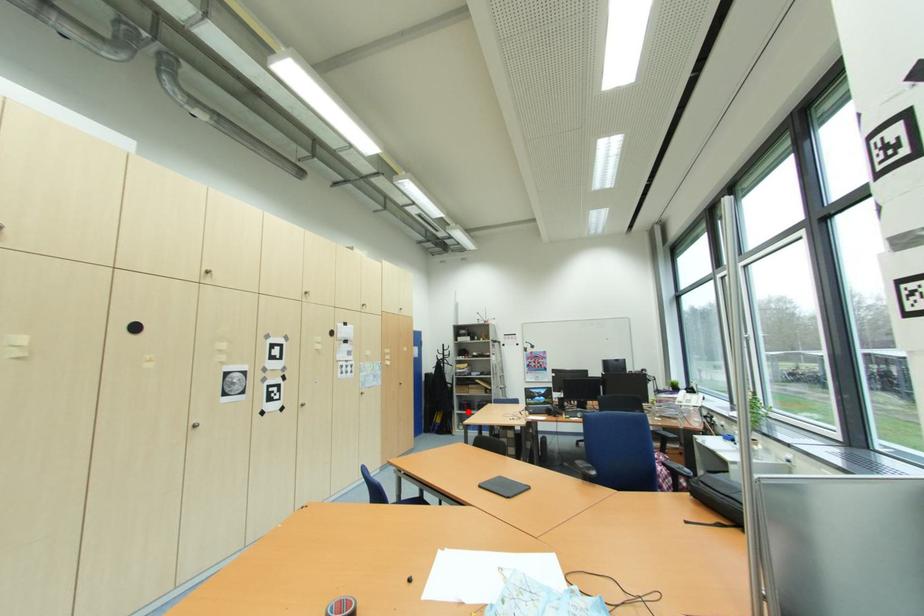
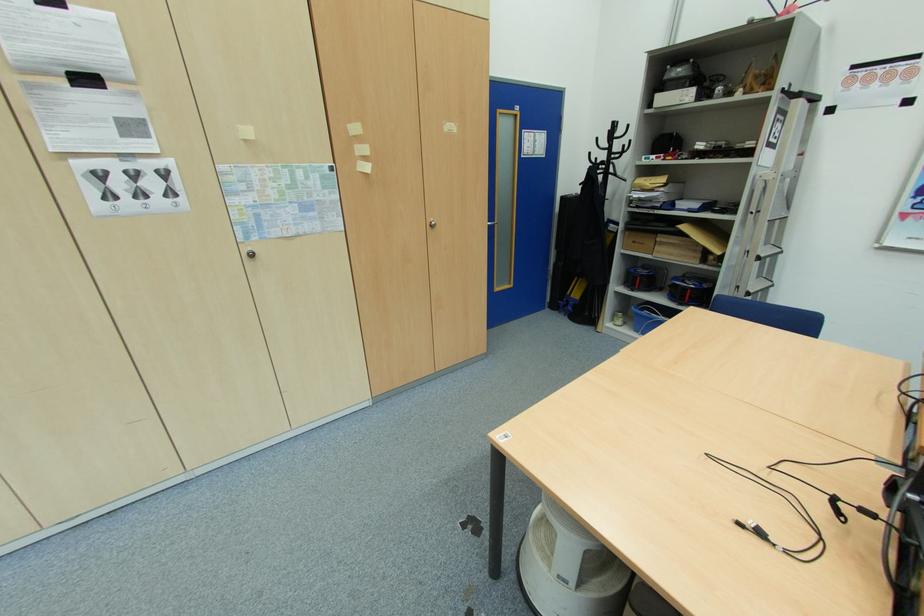
The point at the highlighted location is marked in the first image. Where is the corresponding point in the second image?

(637, 291)